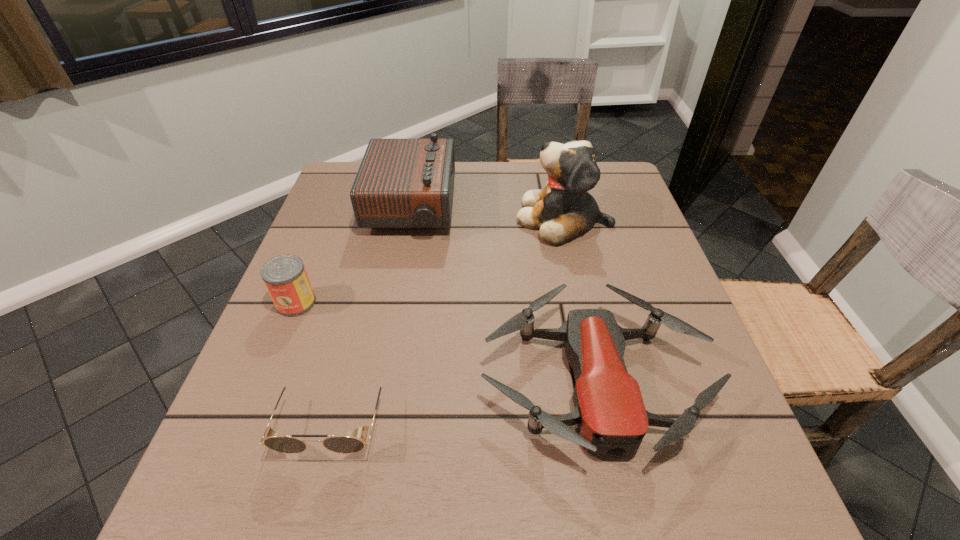
What are the coordinates of `vacant area that satisfies the following two spatial constraints: 1. at the face of the puppy; 2. on the front-facing side of the drone` in the screenshot? It's located at (601, 380).

Identify the location of vacant region that satisfies the following two spatial constraints: 1. at the face of the tallest object; 2. on the front-facing side of the drone. This screenshot has height=540, width=960. (601, 380).